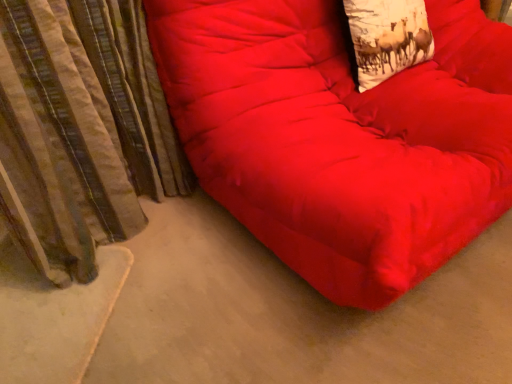
Where is `matte red beanbag at center`? The image size is (512, 384). matte red beanbag at center is located at coordinates (341, 136).

The height and width of the screenshot is (384, 512). What are the coordinates of `white cotton throw pillow at upper right` in the screenshot? It's located at (387, 37).

At what (x,y) coordinates should I click in order to perform the action: click on matte red beanbag at center. Please return your answer as a coordinate pair (x, y). The image size is (512, 384). Looking at the image, I should click on (341, 136).

Does white cotton throw pillow at upper right lie behind striped fabric curtain at left?

Yes, white cotton throw pillow at upper right is behind striped fabric curtain at left.

Is white cotton throw pillow at upper right facing towards striped fabric curtain at left?

No, white cotton throw pillow at upper right is not facing towards striped fabric curtain at left.

Locate an element on the screen. The height and width of the screenshot is (384, 512). curtain in front of the white cotton throw pillow at upper right is located at coordinates (81, 130).

In the scene shown: Can you confirm if white cotton throw pillow at upper right is taller than striped fabric curtain at left?

Incorrect, the height of white cotton throw pillow at upper right is not larger of that of striped fabric curtain at left.

From the image's perspective, which is above, striped fabric curtain at left or matte red beanbag at center?

matte red beanbag at center, from the image's perspective.

Is striped fabric curtain at left bigger or smaller than matte red beanbag at center?

Considering their sizes, striped fabric curtain at left takes up less space than matte red beanbag at center.

Looking at this image, between striped fabric curtain at left and matte red beanbag at center, which one has less height?

striped fabric curtain at left is shorter.

Is striped fabric curtain at left directly adjacent to matte red beanbag at center?

There is a gap between striped fabric curtain at left and matte red beanbag at center.

From the image's perspective, does matte red beanbag at center appear lower than white cotton throw pillow at upper right?

Indeed, from the image's perspective, matte red beanbag at center is shown beneath white cotton throw pillow at upper right.

Is matte red beanbag at center positioned with its back to white cotton throw pillow at upper right?

Yes, matte red beanbag at center is facing away from white cotton throw pillow at upper right.

Would you say matte red beanbag at center is inside or outside white cotton throw pillow at upper right?

matte red beanbag at center is spatially situated outside white cotton throw pillow at upper right.

Between matte red beanbag at center and white cotton throw pillow at upper right, which one has smaller size?

With smaller size is white cotton throw pillow at upper right.

Can you confirm if white cotton throw pillow at upper right is thinner than matte red beanbag at center?

Yes, white cotton throw pillow at upper right is thinner than matte red beanbag at center.

Is white cotton throw pillow at upper right further to the viewer compared to matte red beanbag at center?

Yes, it is behind matte red beanbag at center.

From a real-world perspective, which is physically below, white cotton throw pillow at upper right or matte red beanbag at center?

matte red beanbag at center, from a real-world perspective.

Is white cotton throw pillow at upper right positioned with its back to matte red beanbag at center?

Correct, white cotton throw pillow at upper right is looking away from matte red beanbag at center.

Considering their positions, is striped fabric curtain at left located in front of or behind white cotton throw pillow at upper right?

striped fabric curtain at left is in front of white cotton throw pillow at upper right.

Between striped fabric curtain at left and white cotton throw pillow at upper right, which one appears on the left side from the viewer's perspective?

From the viewer's perspective, striped fabric curtain at left appears more on the left side.

Is white cotton throw pillow at upper right at the back of striped fabric curtain at left?

No.

Locate an element on the screen. The width and height of the screenshot is (512, 384). furniture in front of the striped fabric curtain at left is located at coordinates (341, 136).

From the image's perspective, is matte red beanbag at center above or below striped fabric curtain at left?

Clearly, from the image's perspective, matte red beanbag at center is above striped fabric curtain at left.

Is matte red beanbag at center oriented towards striped fabric curtain at left?

No, matte red beanbag at center is not facing towards striped fabric curtain at left.

Between matte red beanbag at center and striped fabric curtain at left, which one has larger size?

With larger size is matte red beanbag at center.

Find the location of `curtain that is under the white cotton throw pillow at upper right (from a real-world perspective)`. curtain that is under the white cotton throw pillow at upper right (from a real-world perspective) is located at coordinates (81, 130).

Where is `furniture on the right of striped fabric curtain at left`? furniture on the right of striped fabric curtain at left is located at coordinates (341, 136).

Considering their positions, is white cotton throw pillow at upper right positioned closer to striped fabric curtain at left than matte red beanbag at center?

Based on the image, matte red beanbag at center appears to be nearer to striped fabric curtain at left.

Which object lies further to the anchor point striped fabric curtain at left, matte red beanbag at center or white cotton throw pillow at upper right?

Among the two, white cotton throw pillow at upper right is located further to striped fabric curtain at left.

Considering their positions, is matte red beanbag at center positioned further to white cotton throw pillow at upper right than striped fabric curtain at left?

Based on the image, striped fabric curtain at left appears to be further to white cotton throw pillow at upper right.

Looking at the image, which one is located closer to matte red beanbag at center, white cotton throw pillow at upper right or striped fabric curtain at left?

white cotton throw pillow at upper right is closer to matte red beanbag at center.

When comparing their distances from matte red beanbag at center, does striped fabric curtain at left or white cotton throw pillow at upper right seem closer?

white cotton throw pillow at upper right is positioned closer to the anchor matte red beanbag at center.

Considering their positions, is striped fabric curtain at left positioned further to white cotton throw pillow at upper right than matte red beanbag at center?

The object further to white cotton throw pillow at upper right is striped fabric curtain at left.

You are a GUI agent. You are given a task and a screenshot of the screen. Output one action in this format:
    pyautogui.click(x=<x>, y=<y>)
    Task: Click on the throw pillow between striped fabric curtain at left and matte red beanbag at center in the horizontal direction
    
    Given the screenshot: What is the action you would take?
    pyautogui.click(x=387, y=37)